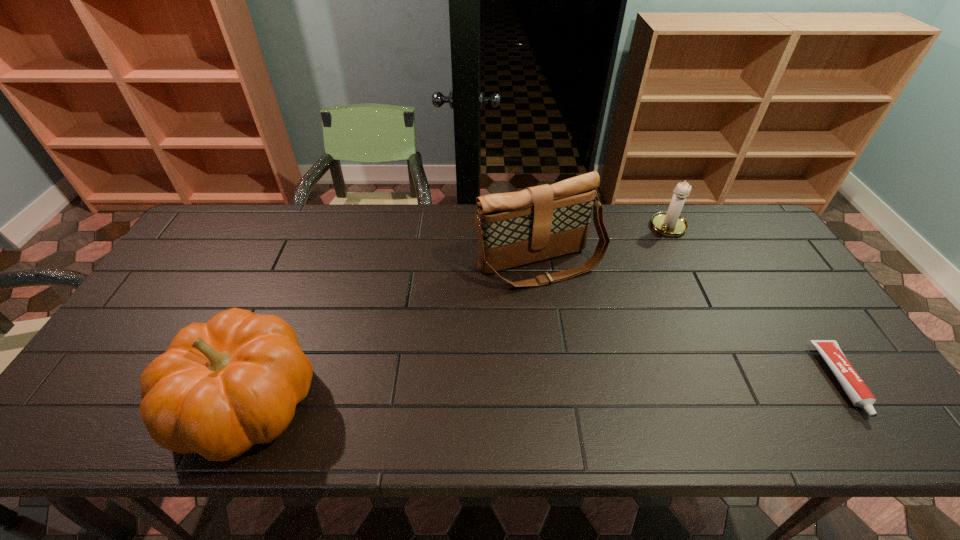
Where is `free space between the shortest object and the third nearest object`? The height and width of the screenshot is (540, 960). free space between the shortest object and the third nearest object is located at coordinates (691, 322).

Find the location of a particular element. unoccupied area between the second object from left to right and the pumpkin is located at coordinates tap(394, 334).

Where is `free space between the second farthest object and the toothpaste`? free space between the second farthest object and the toothpaste is located at coordinates (691, 322).

Identify the location of free spot between the third object from right to left and the pumpkin. tap(394, 334).

Identify which object is located as the nearest to the pumpkin. Please provide its 2D coordinates. Your answer should be formatted as a tuple, i.e. [(x, y)], where the tuple contains the x and y coordinates of a point satisfying the conditions above.

[(516, 228)]

Identify the location of object that is the second closest to the shoulder bag. (221, 387).

The width and height of the screenshot is (960, 540). I want to click on free location that satisfies the following two spatial constraints: 1. on the back side of the pumpkin; 2. on the left side of the third tallest object, so click(x=319, y=227).